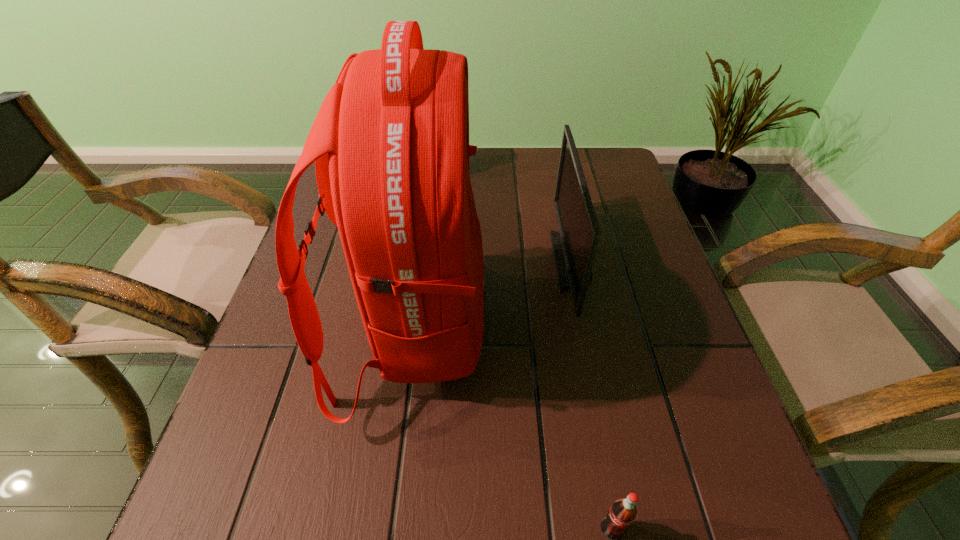
Identify the location of the leftmost object. This screenshot has width=960, height=540. (390, 142).

I want to click on backpack, so click(x=390, y=142).

This screenshot has height=540, width=960. In order to click on the second tallest object in this screenshot , I will do `click(574, 247)`.

I want to click on vacant position located on the main compartment of the tallest object, so click(x=667, y=326).

Locate an element on the screen. Image resolution: width=960 pixels, height=540 pixels. vacant region located on the screen side of the second shortest object is located at coordinates (408, 261).

I want to click on free space located on the screen side of the second shortest object, so click(x=425, y=261).

The image size is (960, 540). Identify the location of blank space located on the screen side of the second shortest object. (479, 261).

Where is `object that is at the left edge`? The height and width of the screenshot is (540, 960). object that is at the left edge is located at coordinates (390, 142).

Identify the location of vacant space at the near edge of the desktop. The height and width of the screenshot is (540, 960). (540, 539).

Identify the location of vacant space at the left edge. The width and height of the screenshot is (960, 540). (331, 346).